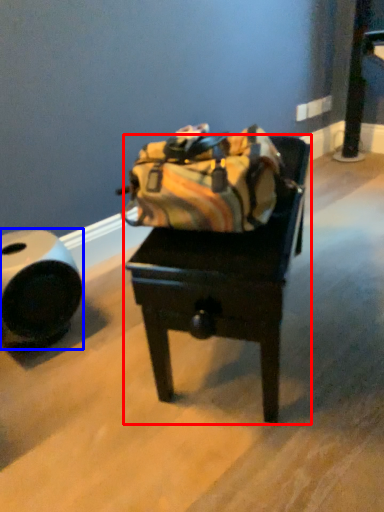
Question: Among these objects, which one is nearest to the camera, furniture (highlighted by a red box) or tube (highlighted by a blue box)?

Choices:
 (A) furniture
 (B) tube

Answer: (A)